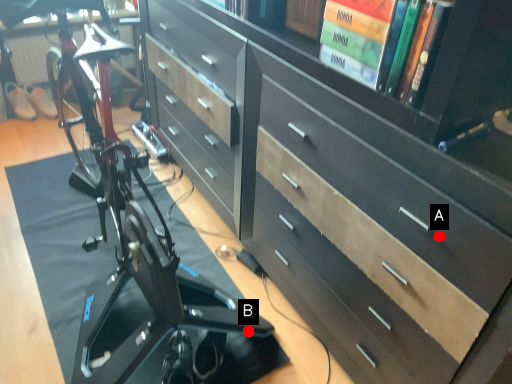
Question: Two points are circled on the image, labeled by A and B beside each circle. Which point is farther from the camera taking this photo?

Choices:
 (A) A is further
 (B) B is further

Answer: (B)